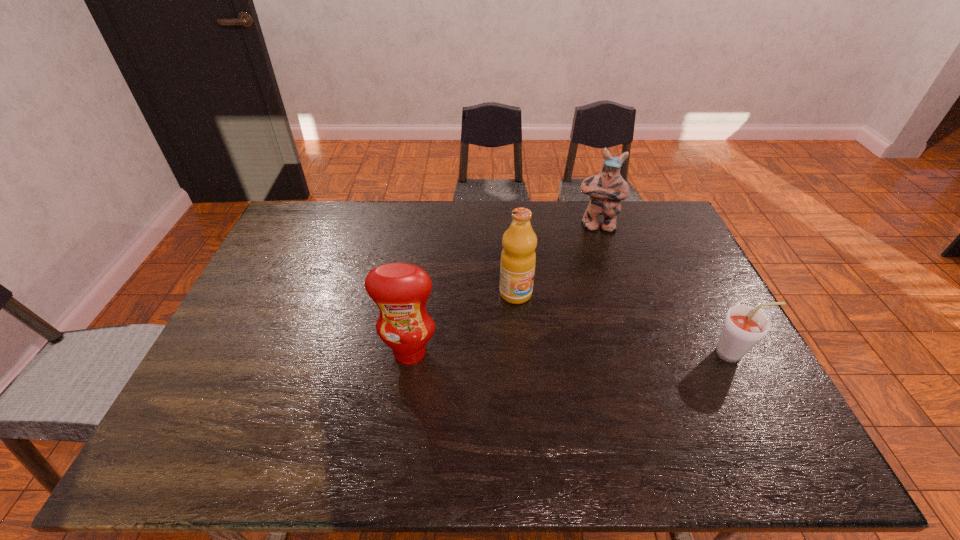
Find the location of a particular element. vacant area located on the front-facing side of the farthest object is located at coordinates (598, 267).

You are a GUI agent. You are given a task and a screenshot of the screen. Output one action in this format:
    pyautogui.click(x=<x>, y=<y>)
    Task: Click on the blank space located 0.180m on the front label of the second object from left to right
    The width and height of the screenshot is (960, 540).
    Given the screenshot: What is the action you would take?
    pyautogui.click(x=563, y=346)

This screenshot has height=540, width=960. What are the coordinates of `vacant space located 0.070m on the front label of the second object from left to right` in the screenshot? It's located at (539, 319).

At what (x,y) coordinates should I click in order to perform the action: click on vacant point located 0.150m on the front label of the second object from left to right. Please return your answer as a coordinate pair (x, y). The width and height of the screenshot is (960, 540). Looking at the image, I should click on (556, 338).

The image size is (960, 540). What are the coordinates of `object that is at the far edge` in the screenshot? It's located at (606, 190).

At what (x,y) coordinates should I click in order to perform the action: click on object situated at the right edge. Please return your answer as a coordinate pair (x, y). This screenshot has height=540, width=960. Looking at the image, I should click on (744, 326).

Locate an element on the screen. vacant space at the far edge is located at coordinates (447, 221).

This screenshot has height=540, width=960. Identify the location of vacant area at the near edge of the desktop. (317, 412).

Identify the location of blank space at the left edge of the desktop. (240, 359).

The height and width of the screenshot is (540, 960). Identify the location of free space at the right edge of the desktop. tap(673, 278).